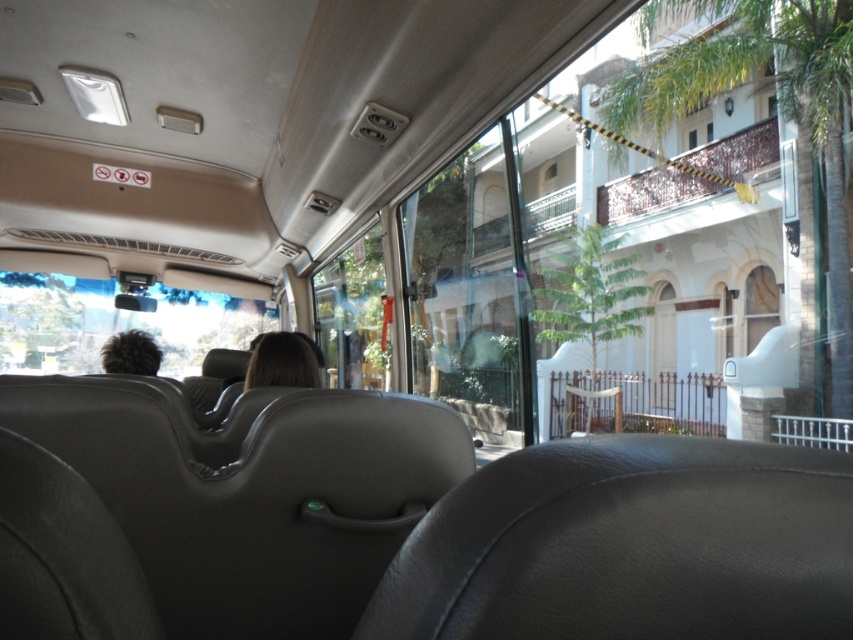
Can you confirm if brown hair at center is smaller than dark brown hair at left?

Actually, brown hair at center might be larger than dark brown hair at left.

Can you confirm if brown hair at center is shorter than dark brown hair at left?

Indeed, brown hair at center has a lesser height compared to dark brown hair at left.

Does point (299, 358) come in front of point (155, 371)?

Yes, point (299, 358) is in front of point (155, 371).

Locate an element on the screen. This screenshot has width=853, height=640. brown hair at center is located at coordinates (283, 362).

Is transparent plastic window at upper left to the left of brown hair at center from the viewer's perspective?

Yes, transparent plastic window at upper left is to the left of brown hair at center.

Who is more forward, (113, 292) or (302, 378)?

Positioned in front is point (302, 378).

Which is behind, point (44, 276) or point (309, 374)?

Point (44, 276)

The height and width of the screenshot is (640, 853). I want to click on transparent plastic window at upper left, so click(x=115, y=323).

Based on the photo, does transparent plastic window at upper left have a greater width compared to dark brown hair at left?

Yes, transparent plastic window at upper left is wider than dark brown hair at left.

Is transparent plastic window at upper left taller than dark brown hair at left?

Yes.

Is point (149, 317) more distant than point (114, 337)?

Yes, point (149, 317) is behind point (114, 337).

Identify the location of transparent plastic window at upper left. (115, 323).